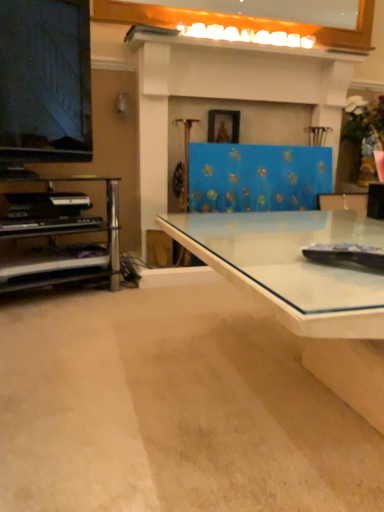
Locate an element on the screen. The width and height of the screenshot is (384, 512). vacant space to the right of metallic silver shelf at left is located at coordinates (150, 298).